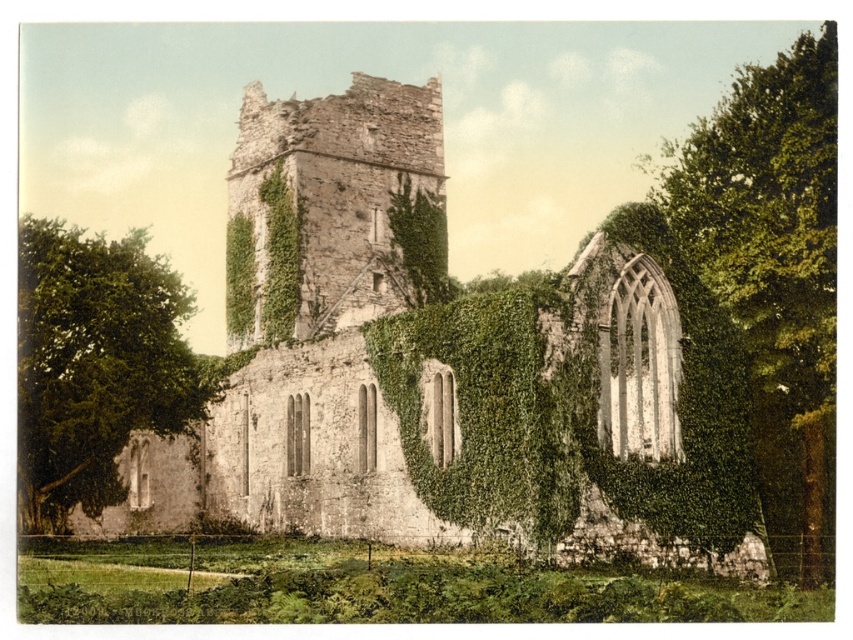
Question: Which object is farther from the camera taking this photo?

Choices:
 (A) green leafy tree at left
 (B) green leafy tree at right
 (C) green ivy-covered stone church at center

Answer: (A)

Question: Observing the image, what is the correct spatial positioning of green ivy-covered stone church at center in reference to green leafy tree at right?

Choices:
 (A) left
 (B) right

Answer: (A)

Question: Does green leafy tree at right appear under green leafy tree at left?

Choices:
 (A) yes
 (B) no

Answer: (B)

Question: Does green ivy-covered stone church at center appear on the right side of green leafy tree at left?

Choices:
 (A) yes
 (B) no

Answer: (A)

Question: Which is farther from the green ivy-covered stone church at center?

Choices:
 (A) green leafy tree at left
 (B) green leafy tree at right

Answer: (B)

Question: Which object is positioned closest to the green ivy-covered stone church at center?

Choices:
 (A) green leafy tree at right
 (B) green leafy tree at left

Answer: (B)